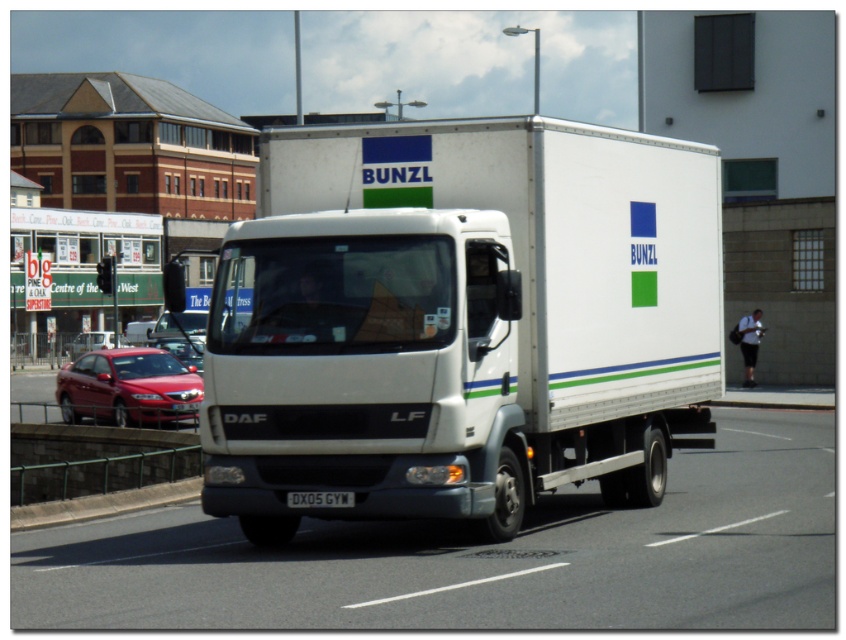
Question: Is white matte truck at center closer to the viewer compared to shiny red sedan at lower left?

Choices:
 (A) yes
 (B) no

Answer: (A)

Question: Does shiny red sedan at lower left appear over white plastic license plate at center?

Choices:
 (A) no
 (B) yes

Answer: (B)

Question: Among these points, which one is farthest from the camera?

Choices:
 (A) (69, 401)
 (B) (312, 500)

Answer: (A)

Question: Estimate the real-world distances between objects in this image. Which object is closer to the white plastic license plate at center?

Choices:
 (A) shiny red sedan at lower left
 (B) white matte truck at center

Answer: (B)

Question: Does shiny red sedan at lower left have a smaller size compared to white plastic license plate at center?

Choices:
 (A) yes
 (B) no

Answer: (B)

Question: Which point appears closest to the camera in this image?

Choices:
 (A) (339, 140)
 (B) (154, 396)

Answer: (A)